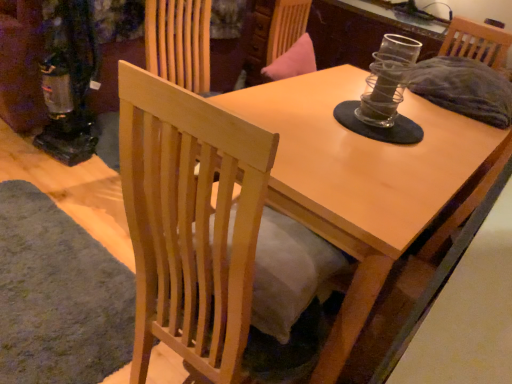
Question: From the image's perspective, is natural wood chair at center on soft gray carpet at lower left?

Choices:
 (A) yes
 (B) no

Answer: (A)

Question: Is natural wood chair at center oriented away from soft gray carpet at lower left?

Choices:
 (A) no
 (B) yes

Answer: (A)

Question: Is the depth of natural wood chair at center less than that of soft gray carpet at lower left?

Choices:
 (A) no
 (B) yes

Answer: (B)

Question: Can you confirm if natural wood chair at center is thinner than soft gray carpet at lower left?

Choices:
 (A) yes
 (B) no

Answer: (A)

Question: Does natural wood chair at center have a smaller size compared to soft gray carpet at lower left?

Choices:
 (A) yes
 (B) no

Answer: (B)

Question: From the image's perspective, is natural wood chair at center positioned above or below soft gray carpet at lower left?

Choices:
 (A) below
 (B) above

Answer: (B)

Question: Considering the positions of natural wood chair at center and soft gray carpet at lower left in the image, is natural wood chair at center bigger or smaller than soft gray carpet at lower left?

Choices:
 (A) small
 (B) big

Answer: (B)

Question: From a real-world perspective, relative to soft gray carpet at lower left, is natural wood chair at center vertically above or below?

Choices:
 (A) below
 (B) above

Answer: (B)

Question: In terms of width, does natural wood chair at center look wider or thinner when compared to soft gray carpet at lower left?

Choices:
 (A) thin
 (B) wide

Answer: (A)

Question: From the image's perspective, is soft gray carpet at lower left positioned above or below light wood table at center?

Choices:
 (A) above
 (B) below

Answer: (B)

Question: From a real-world perspective, is soft gray carpet at lower left positioned above or below light wood table at center?

Choices:
 (A) below
 (B) above

Answer: (A)

Question: Considering the positions of soft gray carpet at lower left and light wood table at center in the image, is soft gray carpet at lower left bigger or smaller than light wood table at center?

Choices:
 (A) small
 (B) big

Answer: (A)

Question: Considering the positions of soft gray carpet at lower left and light wood table at center in the image, is soft gray carpet at lower left taller or shorter than light wood table at center?

Choices:
 (A) tall
 (B) short

Answer: (B)

Question: From the image's perspective, is light wood table at center above or below natural wood chair at center?

Choices:
 (A) above
 (B) below

Answer: (A)

Question: Relative to natural wood chair at center, is light wood table at center in front or behind?

Choices:
 (A) front
 (B) behind

Answer: (B)